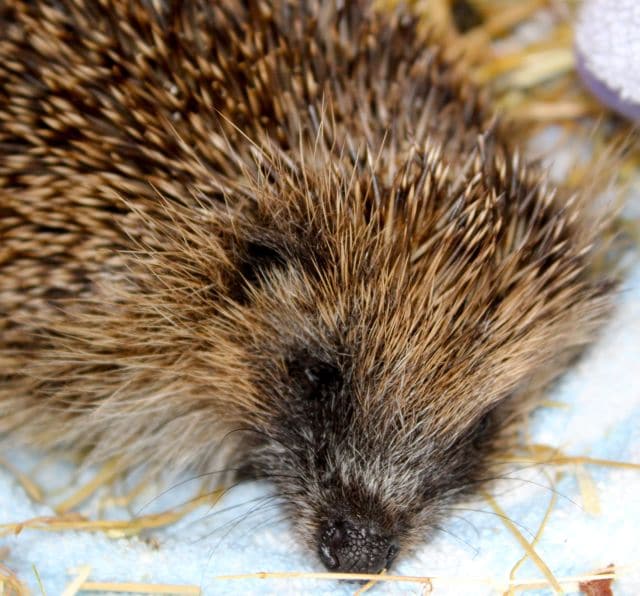
The width and height of the screenshot is (640, 596). I want to click on purple bowl, so click(x=603, y=95).